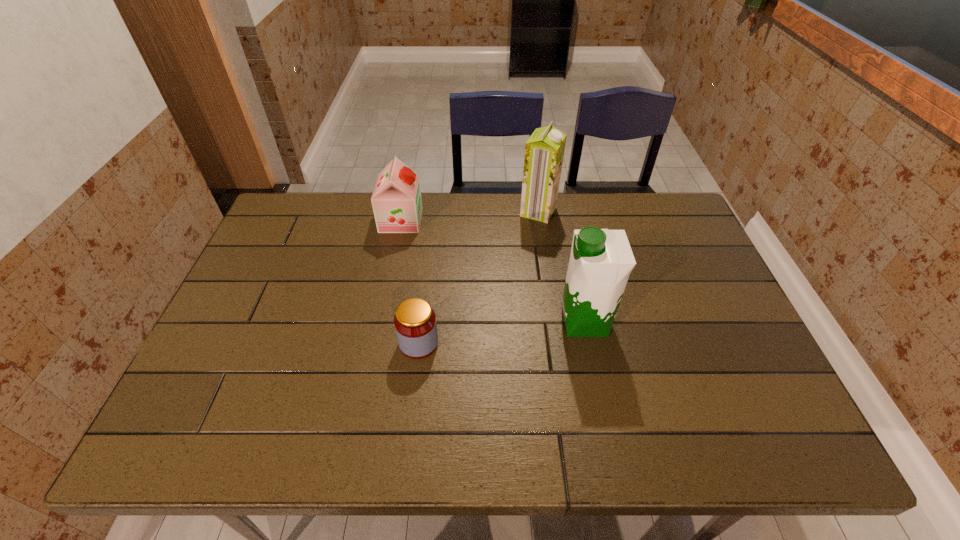
Find the location of a particular element. blank space at the left edge of the desktop is located at coordinates (301, 256).

This screenshot has height=540, width=960. Identify the location of vacant space at the right edge of the desktop. (688, 277).

This screenshot has width=960, height=540. In order to click on free location at the near left corner in this screenshot , I will do `click(214, 453)`.

At what (x,y) coordinates should I click in order to perform the action: click on vacant space at the far right corner. Please return your answer as a coordinate pair (x, y). Looking at the image, I should click on (676, 198).

At what (x,y) coordinates should I click in order to perform the action: click on free space at the near right corner. Please return your answer as a coordinate pair (x, y). The width and height of the screenshot is (960, 540). Looking at the image, I should click on (756, 453).

The image size is (960, 540). What are the coordinates of `unoccupied position between the third tallest object and the nearest soya milk` in the screenshot? It's located at (492, 271).

This screenshot has height=540, width=960. I want to click on free spot between the shortest soya milk and the shortest object, so 410,282.

Identify the location of empty space between the shortest soya milk and the jar. (410, 282).

Identify the location of free space between the shortest object and the leftmost soya milk. The height and width of the screenshot is (540, 960). (410, 282).

Identify the location of free space between the shortest object and the leftmost soya milk. The width and height of the screenshot is (960, 540). (410, 282).